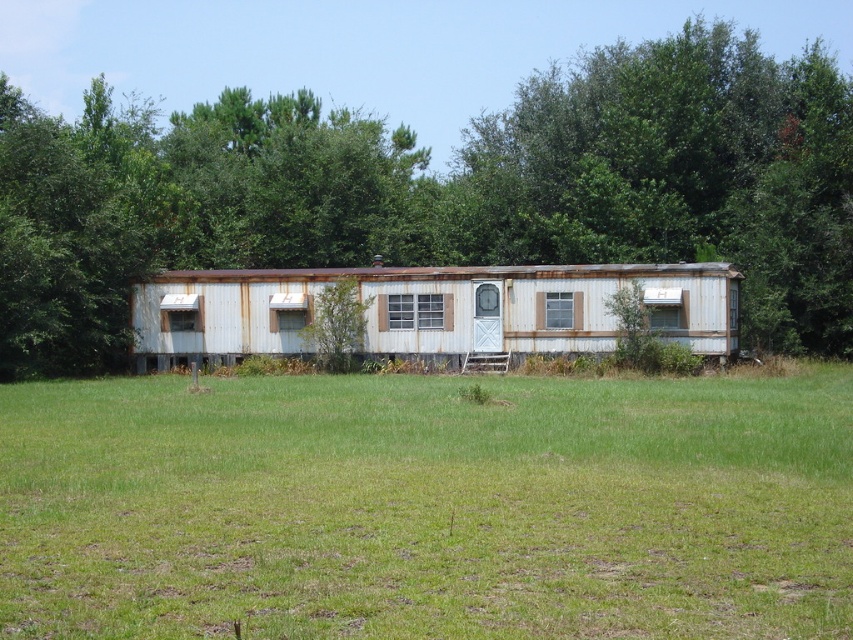
Can you confirm if green grass at center is smaller than rusty metal trailer at center?

Yes, green grass at center is smaller than rusty metal trailer at center.

Is green grass at center wider than rusty metal trailer at center?

In fact, green grass at center might be narrower than rusty metal trailer at center.

Does point (339, 486) lie behind point (163, 323)?

No.

Image resolution: width=853 pixels, height=640 pixels. What are the coordinates of `green grass at center` in the screenshot? It's located at (427, 508).

Based on the photo, does green leafy tree at center have a lesser height compared to rusty metal trailer at center?

No.

The image size is (853, 640). Find the location of `green leafy tree at center`. green leafy tree at center is located at coordinates (440, 189).

Can you confirm if green grass at center is positioned to the right of green leafy tree at center?

Yes, green grass at center is to the right of green leafy tree at center.

Which of these two, green grass at center or green leafy tree at center, stands taller?

Standing taller between the two is green leafy tree at center.

Where is `green grass at center`? The height and width of the screenshot is (640, 853). green grass at center is located at coordinates (427, 508).